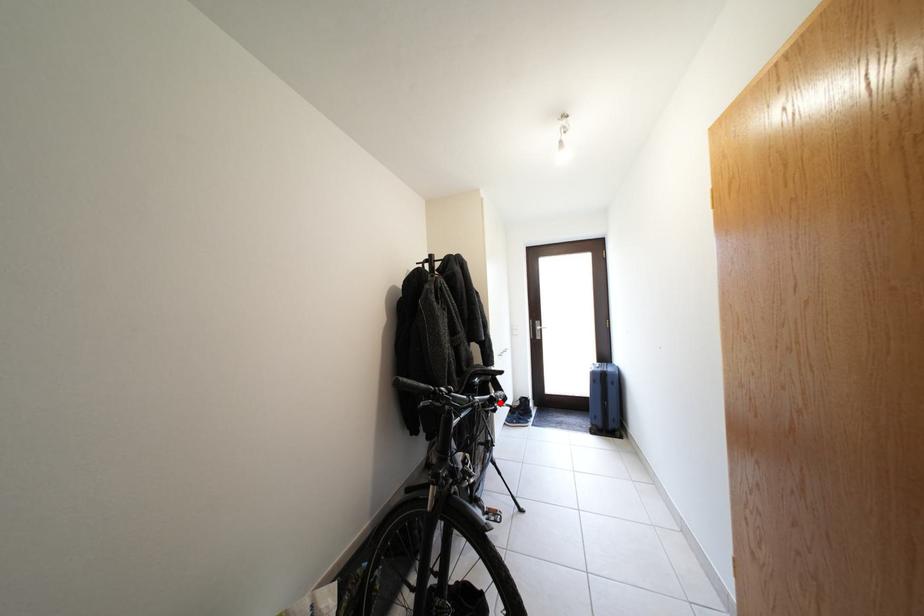
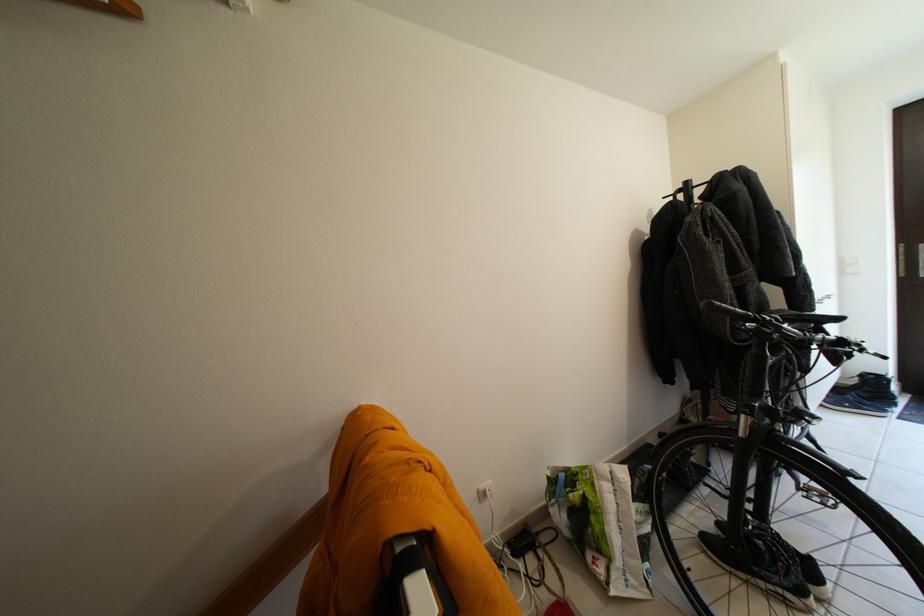
Locate, in the second image, the point that corresponds to the highlighted location in the first image.

(849, 344)